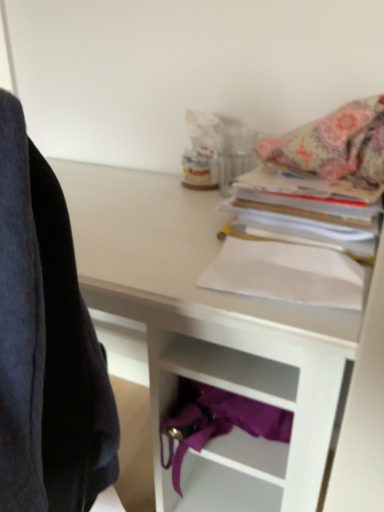
You are a GUI agent. You are given a task and a screenshot of the screen. Output one action in this format:
    pyautogui.click(x=<x>, y=<y>)
    Task: Click on the free region under white paper at center, positioned as the 2th paperback book in top-to-bottom order (from a real-world perspective)
    The height and width of the screenshot is (512, 384).
    Given the screenshot: What is the action you would take?
    pyautogui.click(x=271, y=300)